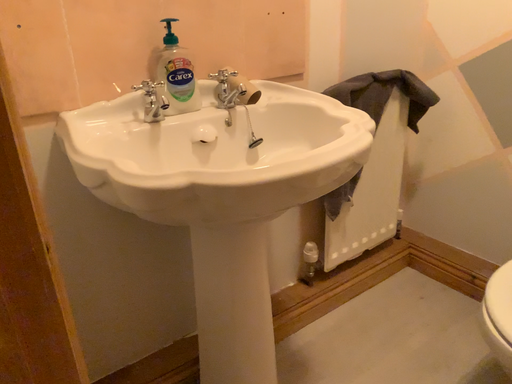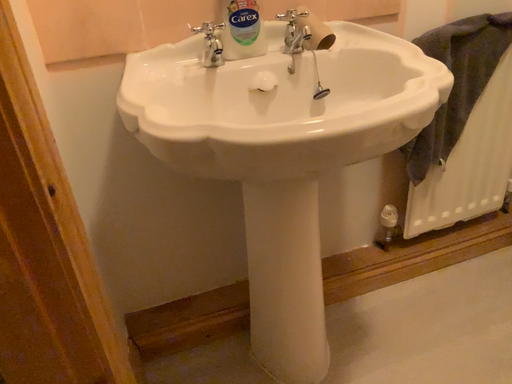
Question: Which way did the camera rotate in the video?

Choices:
 (A) rotated right
 (B) rotated left

Answer: (B)